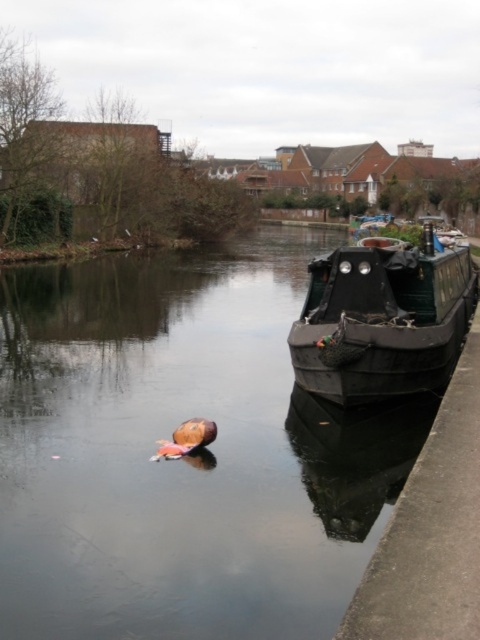
You are a delivery person who needs to place a heavy package on the deck of the dark green wood boat at right and the black matte boat at right. Which boat should you choose if you want to place the package on the higher deck?

The black matte boat at right has a higher deck than the dark green wood boat at right because the dark green wood boat at right is located below it.